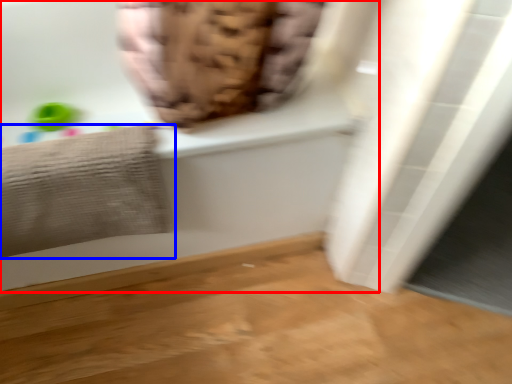
Question: Which point is closer to the camera, bathtub (highlighted by a red box) or towel (highlighted by a blue box)?

Choices:
 (A) bathtub
 (B) towel

Answer: (A)